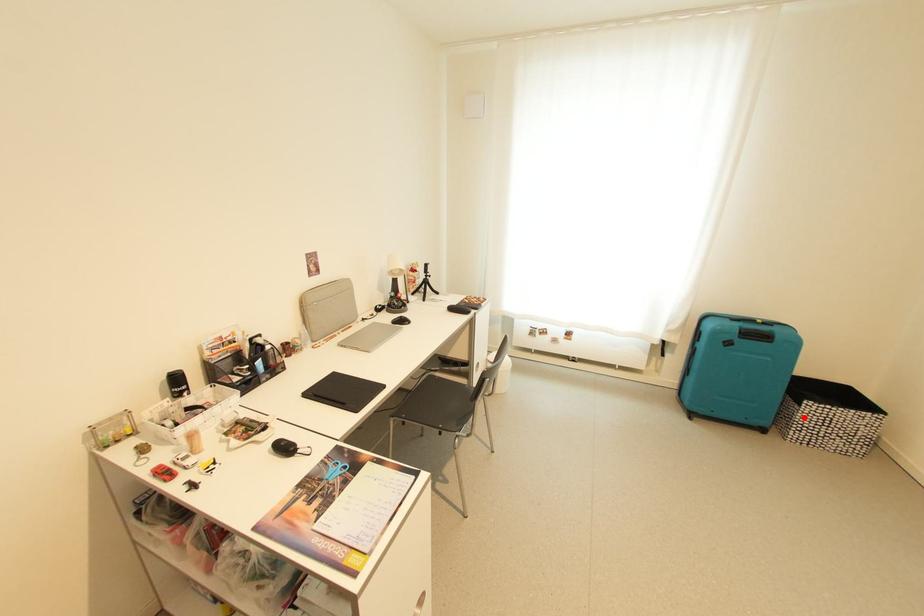
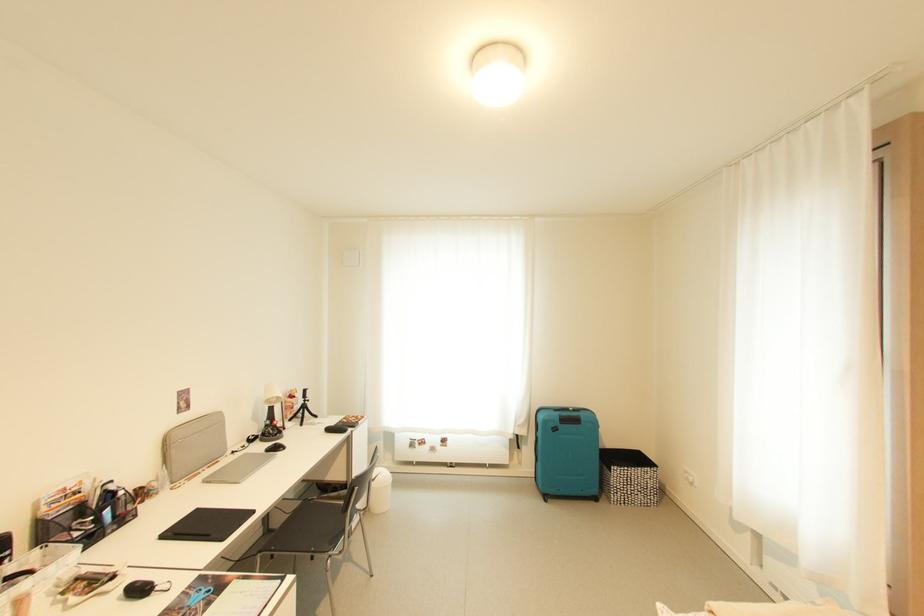
Question: I am providing you with two images of the same scene from different viewpoints. A red point is shown in image1. For the corresponding object point in image2, is it positioned nearer or farther from the camera?

Choices:
 (A) Nearer
 (B) Farther

Answer: (B)